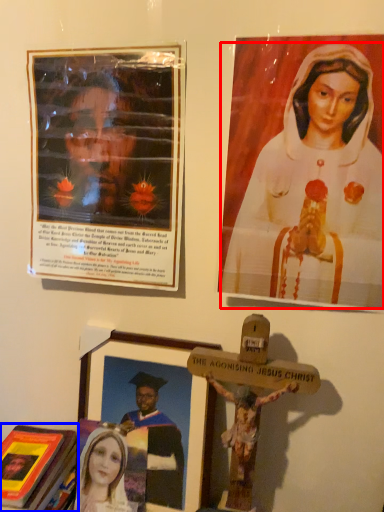
Question: Which object appears closest to the camera in this image, woman (highlighted by a red box) or book (highlighted by a blue box)?

Choices:
 (A) woman
 (B) book

Answer: (A)